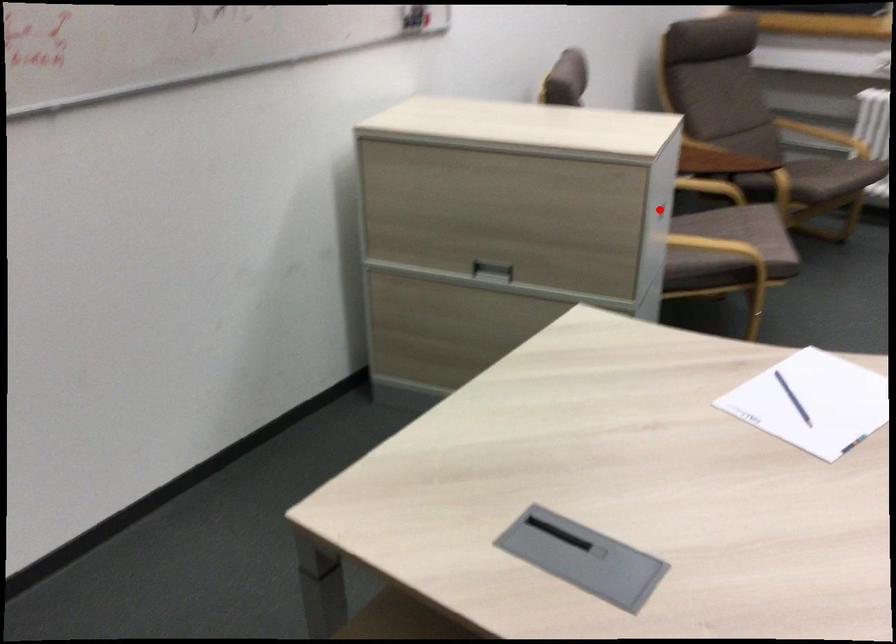
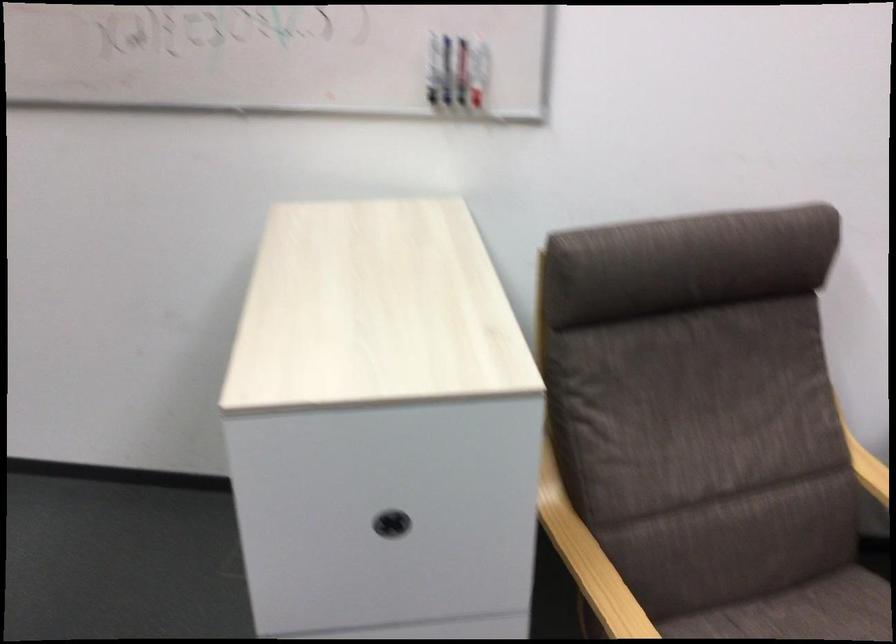
Question: I am providing you with two images of the same scene from different viewpoints. A red point is shown in image1. For the corresponding object point in image2, is it positioned nearer or farther from the camera?

Choices:
 (A) Nearer
 (B) Farther

Answer: (A)